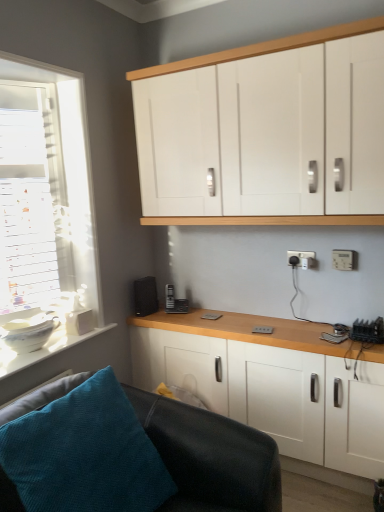
Image resolution: width=384 pixels, height=512 pixels. I want to click on free location to the right of black matte speaker at lower left, so click(x=180, y=314).